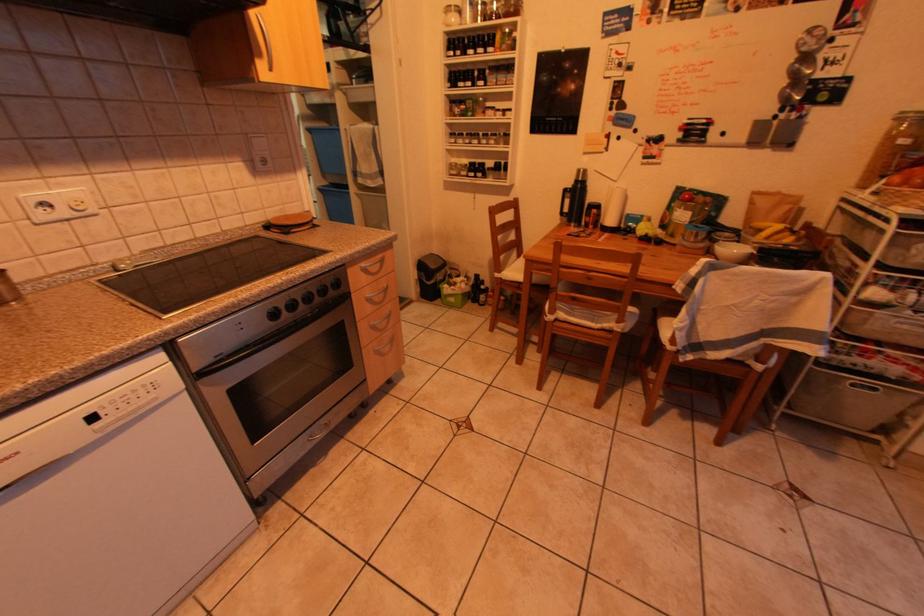
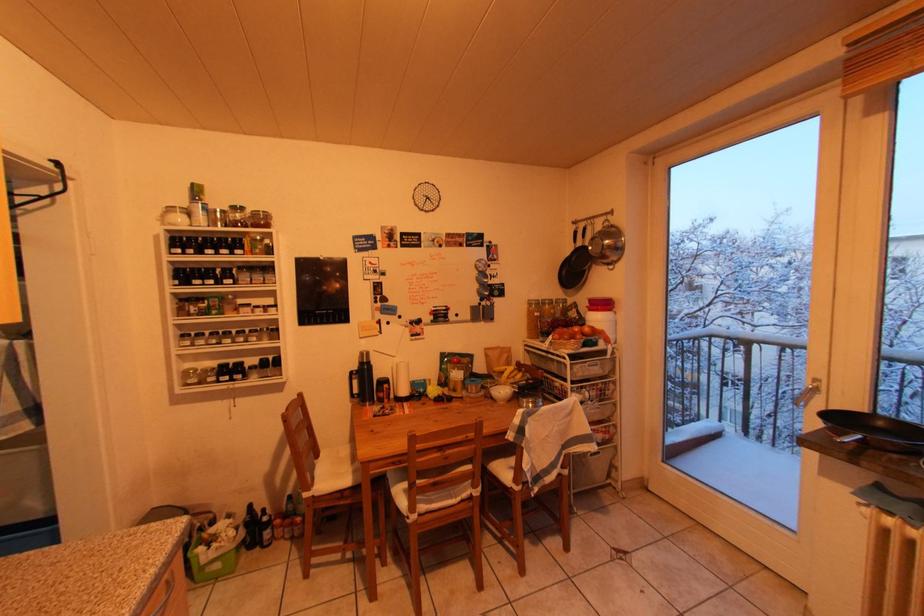
Question: Based on the continuous images, in which direction is the camera rotating? Reply with the corresponding letter.

Choices:
 (A) Left
 (B) Right
 (C) Up
 (D) Down

Answer: (B)